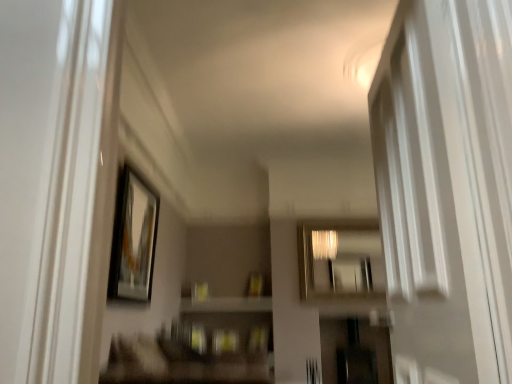
Question: Does metallic reflective mirror at center have a greater width compared to white glossy screen door at right?

Choices:
 (A) no
 (B) yes

Answer: (A)

Question: Is metallic reflective mirror at center turned away from white glossy screen door at right?

Choices:
 (A) yes
 (B) no

Answer: (B)

Question: From a real-world perspective, is metallic reflective mirror at center physically below white glossy screen door at right?

Choices:
 (A) yes
 (B) no

Answer: (B)

Question: Considering the relative positions of metallic reflective mirror at center and white glossy screen door at right in the image provided, is metallic reflective mirror at center to the left of white glossy screen door at right from the viewer's perspective?

Choices:
 (A) no
 (B) yes

Answer: (A)

Question: Is metallic reflective mirror at center smaller than white glossy screen door at right?

Choices:
 (A) no
 (B) yes

Answer: (B)

Question: From the image's perspective, is metallic reflective mirror at center located above white glossy screen door at right?

Choices:
 (A) no
 (B) yes

Answer: (A)

Question: Is metallic reflective mirror at center at the left side of matte black picture frame at upper left?

Choices:
 (A) no
 (B) yes

Answer: (A)

Question: Does metallic reflective mirror at center come in front of matte black picture frame at upper left?

Choices:
 (A) yes
 (B) no

Answer: (B)

Question: Does metallic reflective mirror at center have a smaller size compared to matte black picture frame at upper left?

Choices:
 (A) no
 (B) yes

Answer: (A)

Question: Is metallic reflective mirror at center wider than matte black picture frame at upper left?

Choices:
 (A) yes
 (B) no

Answer: (A)

Question: Can you confirm if metallic reflective mirror at center is shorter than matte black picture frame at upper left?

Choices:
 (A) no
 (B) yes

Answer: (B)

Question: Can you confirm if metallic reflective mirror at center is bigger than matte black picture frame at upper left?

Choices:
 (A) no
 (B) yes

Answer: (B)

Question: Is matte black picture frame at upper left beside white glossy screen door at right?

Choices:
 (A) no
 (B) yes

Answer: (A)